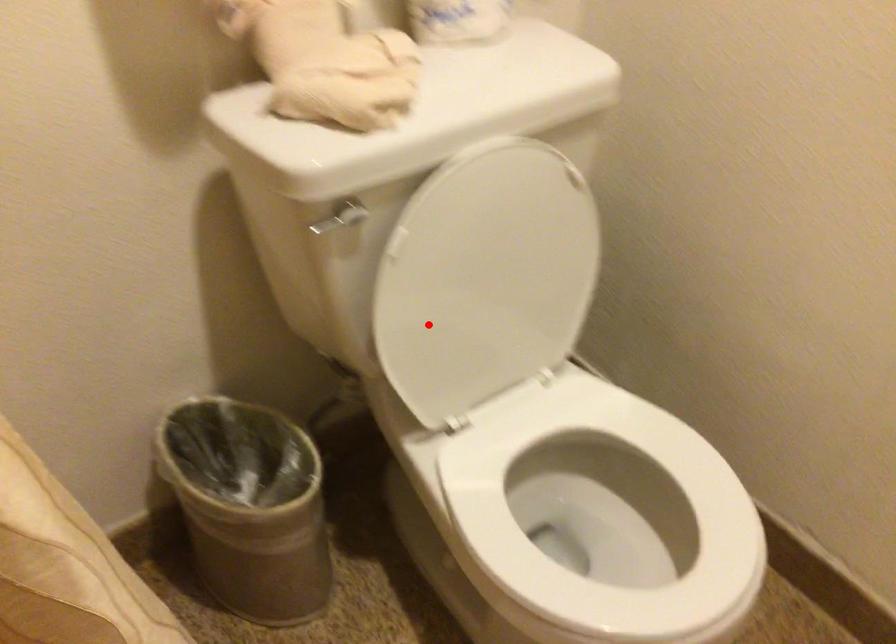
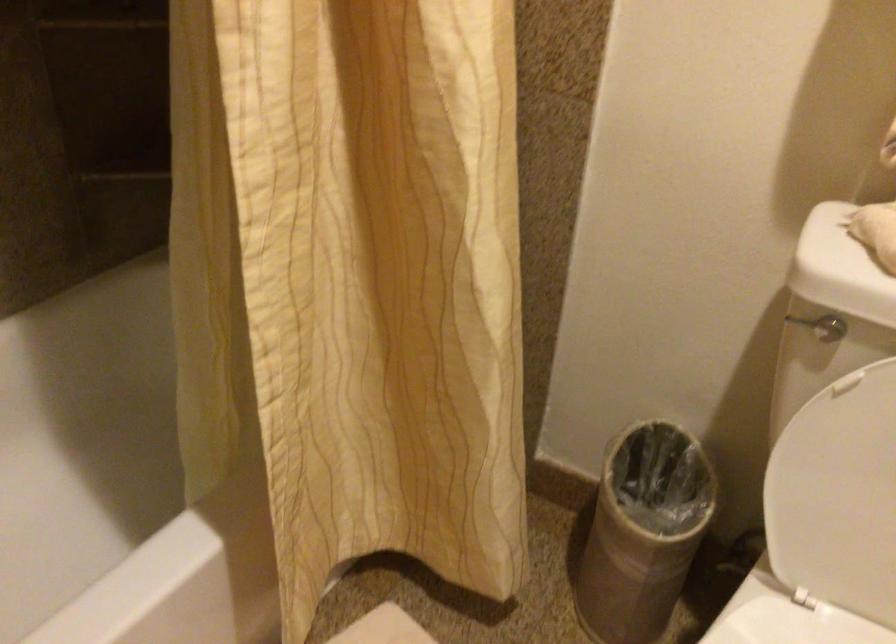
Question: I am providing you with two images of the same scene from different viewpoints. A red point is marked on the first image. Can you still see the location of the red point in image 2?

Choices:
 (A) Yes
 (B) No

Answer: (A)